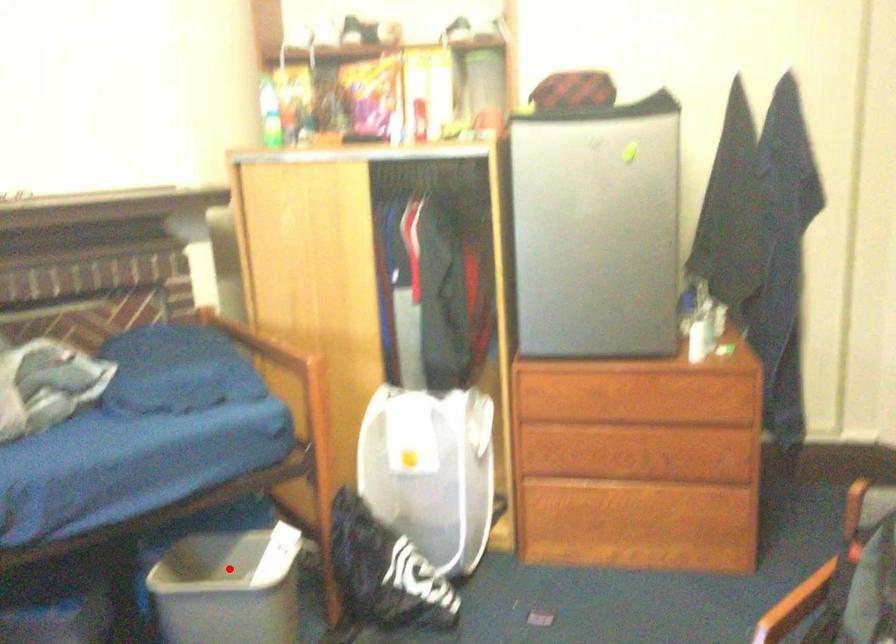
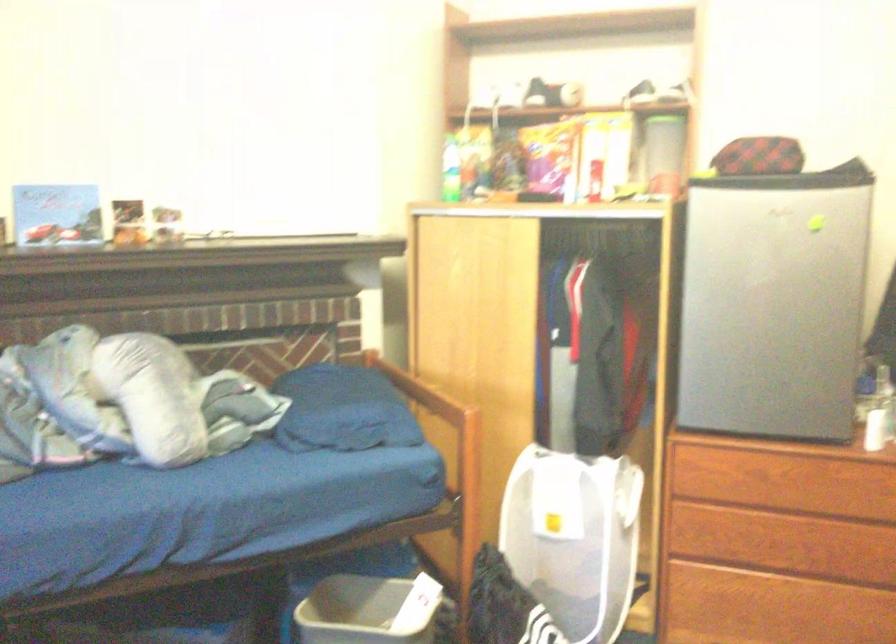
In the second image, find the point that corresponds to the highlighted location in the first image.

(368, 611)